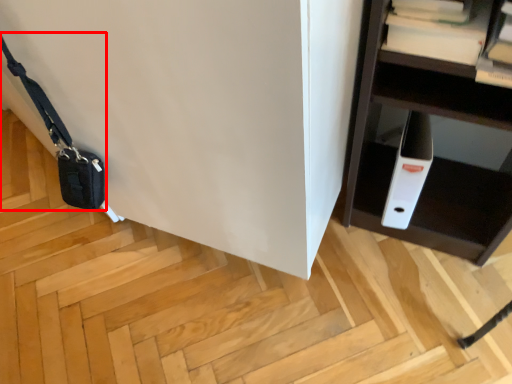
Question: In this image, where is messenger bag (annotated by the red box) located relative to book?

Choices:
 (A) right
 (B) left

Answer: (B)